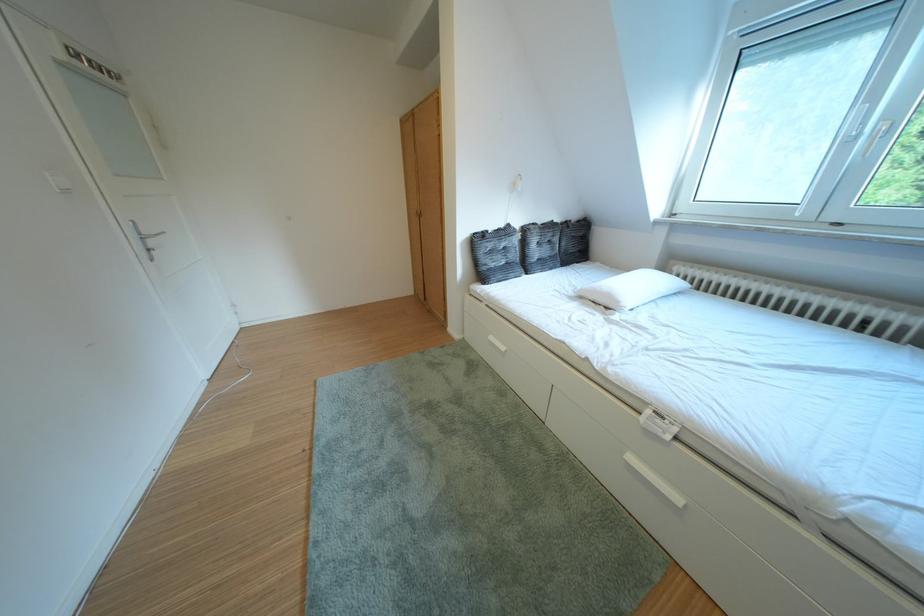
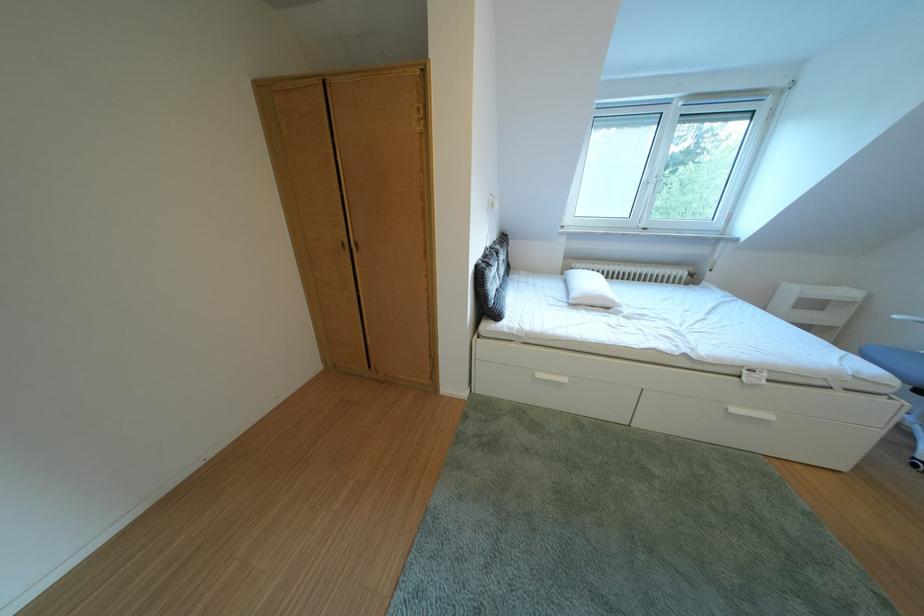
Locate, in the second image, the point that corresponds to the point at 646,464 in the first image.

(748, 415)